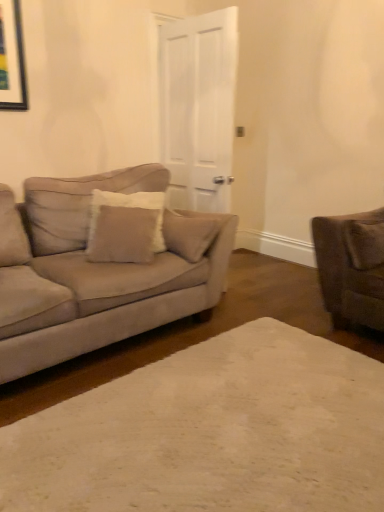
Question: Is white matte door at center wider or thinner than suede-like brown pillow at right, positioned as the 1th pillow in right-to-left order?

Choices:
 (A) wide
 (B) thin

Answer: (B)

Question: From the image's perspective, is white matte door at center located above or below suede-like brown pillow at right, positioned as the 1th pillow in right-to-left order?

Choices:
 (A) above
 (B) below

Answer: (A)

Question: Estimate the real-world distances between objects in this image. Which object is closer to the white matte door at center?

Choices:
 (A) beige fabric pillow at center, placed as the first pillow when sorted from left to right
 (B) suede-like brown pillow at right, acting as the second pillow starting from the left
 (C) beige carpet at center
 (D) suede beige couch at left

Answer: (A)

Question: Which of these objects is positioned farthest from the suede beige couch at left?

Choices:
 (A) white matte door at center
 (B) suede-like brown pillow at right, acting as the second pillow starting from the left
 (C) beige fabric pillow at center, placed as the first pillow when sorted from left to right
 (D) beige carpet at center

Answer: (B)